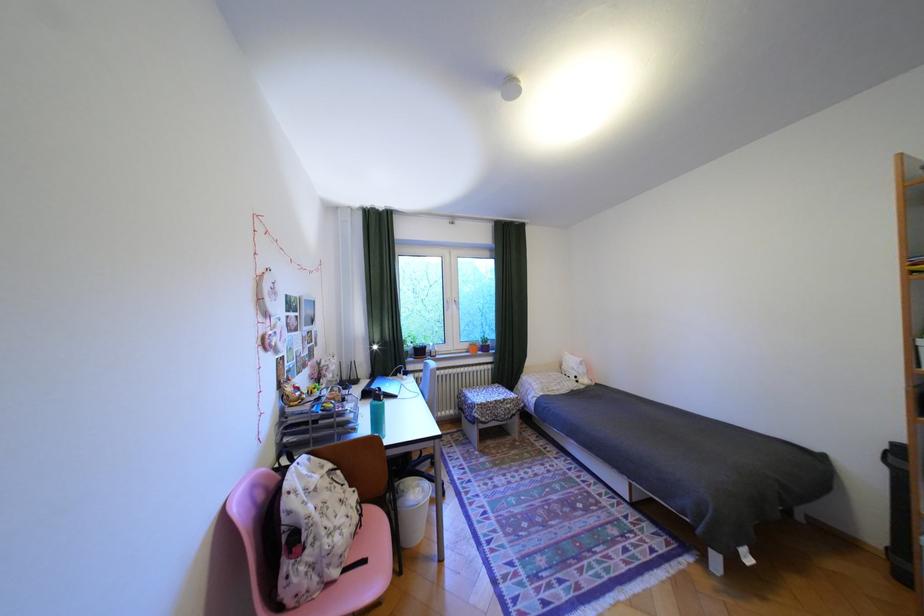
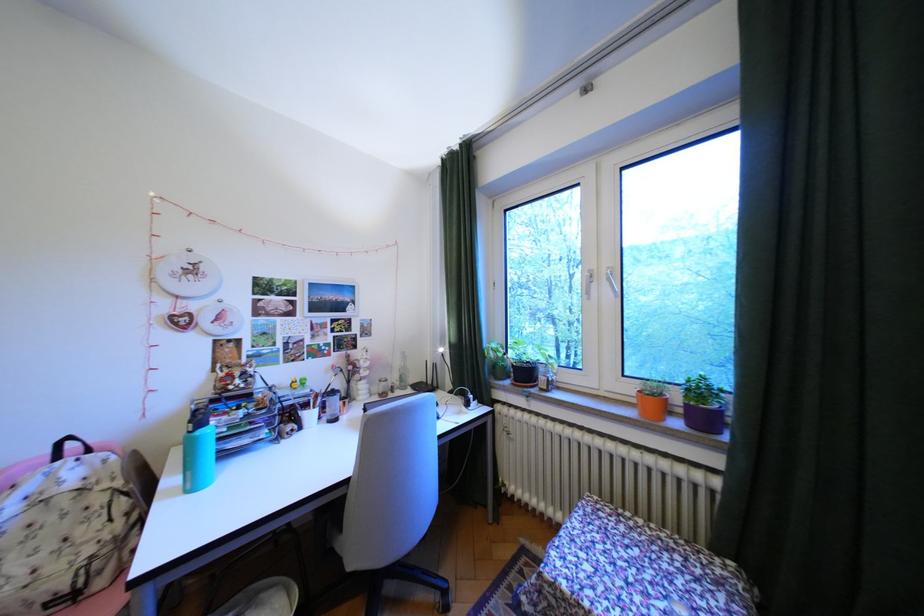
Question: I am providing you with two images of the same scene from different viewpoints. Please identify which objects are invisible in image2.

Choices:
 (A) purple flower pot
 (B) copper pen cup
 (C) clear glass bottle
 (D) none of these

Answer: (D)